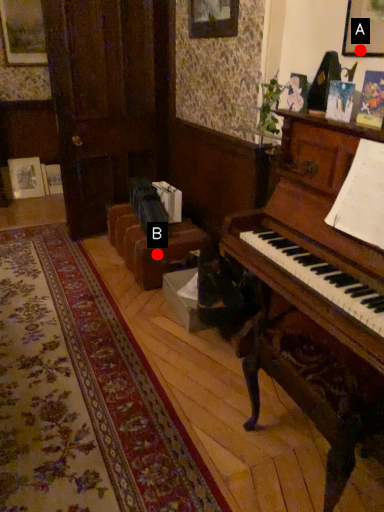
Question: Two points are circled on the image, labeled by A and B beside each circle. Which of the following is the farthest from the observer?

Choices:
 (A) A is further
 (B) B is further

Answer: (B)